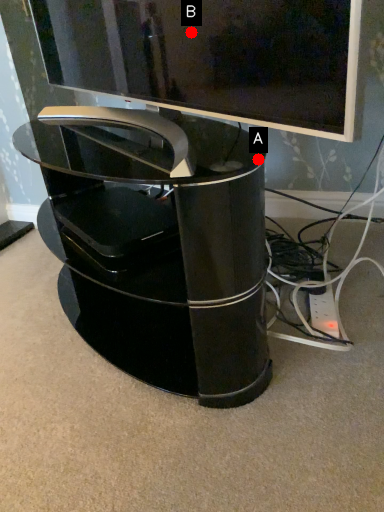
Question: Two points are circled on the image, labeled by A and B beside each circle. Among these points, which one is farthest from the camera?

Choices:
 (A) A is further
 (B) B is further

Answer: (A)